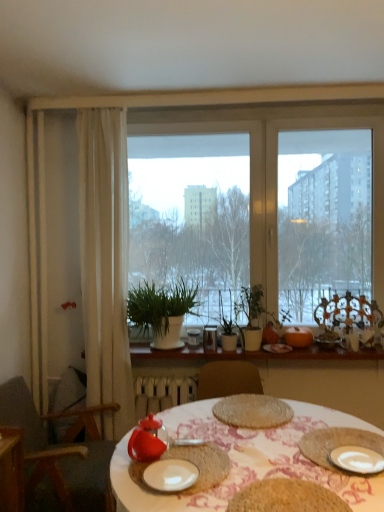
Identify the location of vacant area that lies between baked golden bread at center, which appears as the first food when viewed from the top, and matte red teapot at center, acting as the 1th tableware starting from the front. (229, 438).